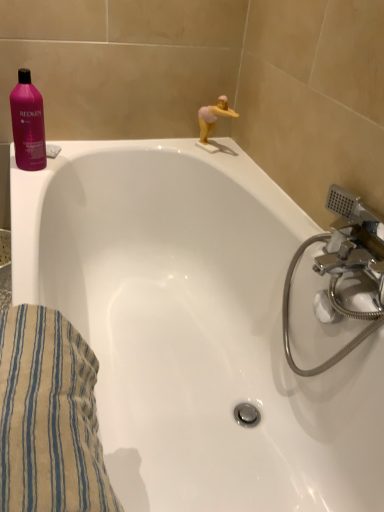
This screenshot has height=512, width=384. In order to click on unoccupied space behind pink glossy shampoo at upper left in this screenshot , I will do `click(71, 147)`.